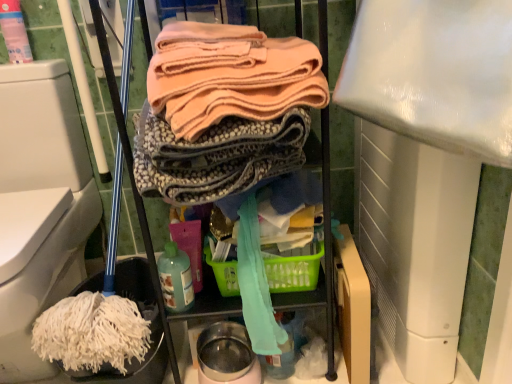
Question: Is pink plastic spray bottle at upper left surrounded by white fabric mop head at lower left?

Choices:
 (A) yes
 (B) no

Answer: (B)

Question: Could you tell me if white fabric mop head at lower left is turned towards pink plastic spray bottle at upper left?

Choices:
 (A) yes
 (B) no

Answer: (B)

Question: From a real-world perspective, is white fabric mop head at lower left under pink plastic spray bottle at upper left?

Choices:
 (A) yes
 (B) no

Answer: (A)

Question: Considering the relative sizes of white fabric mop head at lower left and pink plastic spray bottle at upper left in the image provided, is white fabric mop head at lower left smaller than pink plastic spray bottle at upper left?

Choices:
 (A) yes
 (B) no

Answer: (B)

Question: Is white fabric mop head at lower left touching pink plastic spray bottle at upper left?

Choices:
 (A) no
 (B) yes

Answer: (A)

Question: Is white fabric mop head at lower left located outside pink plastic spray bottle at upper left?

Choices:
 (A) no
 (B) yes

Answer: (B)

Question: Does pink plastic spray bottle at upper left appear on the right side of white fabric mop head at lower left?

Choices:
 (A) no
 (B) yes

Answer: (B)

Question: Does pink plastic spray bottle at upper left have a smaller size compared to white fabric mop head at lower left?

Choices:
 (A) no
 (B) yes

Answer: (B)

Question: From a real-world perspective, is pink plastic spray bottle at upper left physically below white fabric mop head at lower left?

Choices:
 (A) no
 (B) yes

Answer: (A)

Question: Is pink plastic spray bottle at upper left positioned far away from white fabric mop head at lower left?

Choices:
 (A) yes
 (B) no

Answer: (B)

Question: Can you confirm if pink plastic spray bottle at upper left is shorter than white fabric mop head at lower left?

Choices:
 (A) no
 (B) yes

Answer: (B)

Question: Does pink plastic spray bottle at upper left turn towards white fabric mop head at lower left?

Choices:
 (A) yes
 (B) no

Answer: (B)

Question: Is translucent plastic bottle at lower center to the left of pink plastic spray bottle at upper left from the viewer's perspective?

Choices:
 (A) no
 (B) yes

Answer: (A)